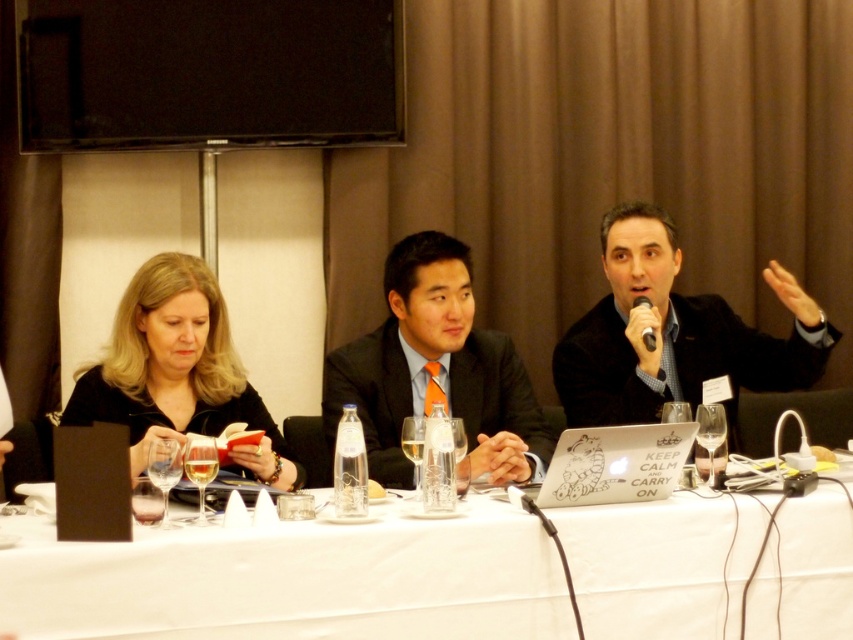
Is black wool suit at right below matte black suit at center?

No, black wool suit at right is not below matte black suit at center.

Who is positioned more to the right, black wool suit at right or matte black suit at center?

Positioned to the right is black wool suit at right.

Between point (590, 368) and point (347, 365), which one is positioned behind?

The point (590, 368) is behind.

I want to click on black wool suit at right, so click(679, 364).

Is black matte jacket at left smaller than black wool suit at right?

Yes, black matte jacket at left is smaller than black wool suit at right.

Is black matte jacket at left closer to the viewer compared to black wool suit at right?

Yes, it is in front of black wool suit at right.

Between point (120, 403) and point (741, 381), which one is positioned behind?

Point (741, 381)

Where is `black matte jacket at left`? black matte jacket at left is located at coordinates tap(178, 371).

Between black wool suit at right and black plastic microphone at upper center, which one is positioned higher?

black plastic microphone at upper center is above.

Does black wool suit at right appear on the right side of black plastic microphone at upper center?

Yes, black wool suit at right is to the right of black plastic microphone at upper center.

Is point (561, 339) positioned behind point (643, 337)?

Yes, it is.

Locate an element on the screen. black wool suit at right is located at coordinates (679, 364).